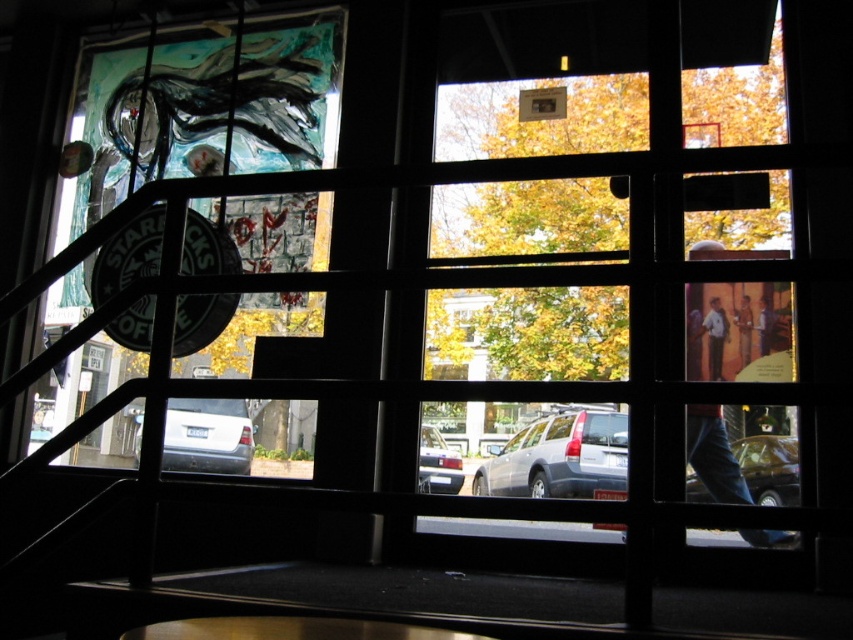
Can you confirm if satin silver sedan at center is positioned to the right of khaki cotton pants at center?

In fact, satin silver sedan at center is to the left of khaki cotton pants at center.

Is satin silver sedan at center behind khaki cotton pants at center?

Yes, it is.

The width and height of the screenshot is (853, 640). What are the coordinates of `satin silver sedan at center` in the screenshot? It's located at (437, 464).

Is denim pants at lower right closer to camera compared to metallic silver car at lower right?

Yes, it is.

Between point (712, 472) and point (689, 486), which one is positioned in front?

Point (712, 472)

Which is behind, point (689, 284) or point (737, 445)?

Point (689, 284)

Identify the location of denim pants at lower right. (712, 454).

Is satin silver car at center positioned at the back of khaki cotton pants at center?

Yes, it is behind khaki cotton pants at center.

Does satin silver car at center appear over khaki cotton pants at center?

No.

You are a GUI agent. You are given a task and a screenshot of the screen. Output one action in this format:
    pyautogui.click(x=<x>, y=<y>)
    Task: Click on the satin silver car at center
    
    Given the screenshot: What is the action you would take?
    pyautogui.click(x=560, y=458)